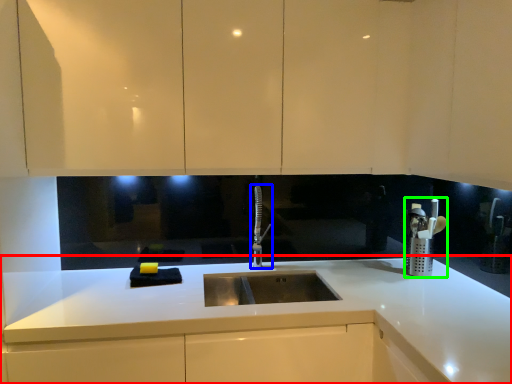
Question: Based on their relative distances, which object is nearer to countertop (highlighted by a red box)? Choose from tap (highlighted by a blue box) and appliance (highlighted by a green box).

Choices:
 (A) tap
 (B) appliance

Answer: (B)